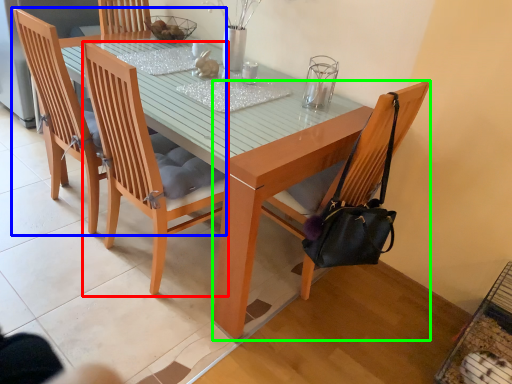
Question: Estimate the real-world distances between objects in this image. Which object is farther from chair (highlighted by a red box), chair (highlighted by a blue box) or chair (highlighted by a green box)?

Choices:
 (A) chair
 (B) chair

Answer: (B)